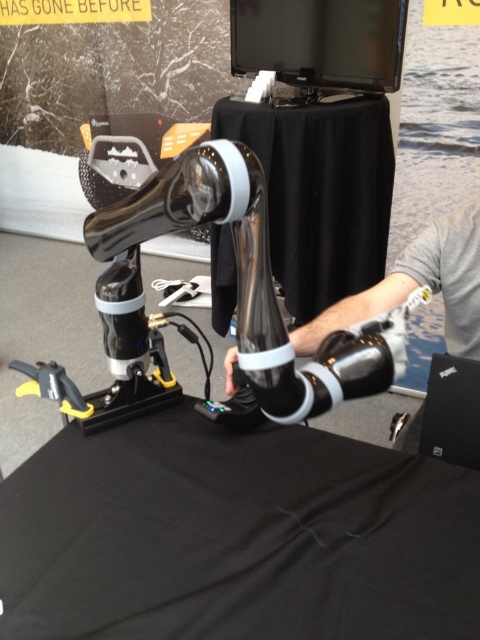
Question: Is black matte table at center further to camera compared to black matte laptop at lower right?

Choices:
 (A) yes
 (B) no

Answer: (A)

Question: Which object is positioned closest to the black matte laptop at lower right?

Choices:
 (A) black fabric table at center
 (B) black matte table at center

Answer: (A)

Question: Considering the relative positions of black fabric table at center and black matte laptop at lower right in the image provided, where is black fabric table at center located with respect to black matte laptop at lower right?

Choices:
 (A) below
 (B) above

Answer: (A)

Question: Which point appears farthest from the camera in this image?

Choices:
 (A) (467, 390)
 (B) (308, 522)
 (C) (369, 134)

Answer: (C)

Question: Does black fabric table at center have a larger size compared to black matte table at center?

Choices:
 (A) yes
 (B) no

Answer: (B)

Question: Among these objects, which one is farthest from the camera?

Choices:
 (A) black fabric table at center
 (B) black matte laptop at lower right

Answer: (B)